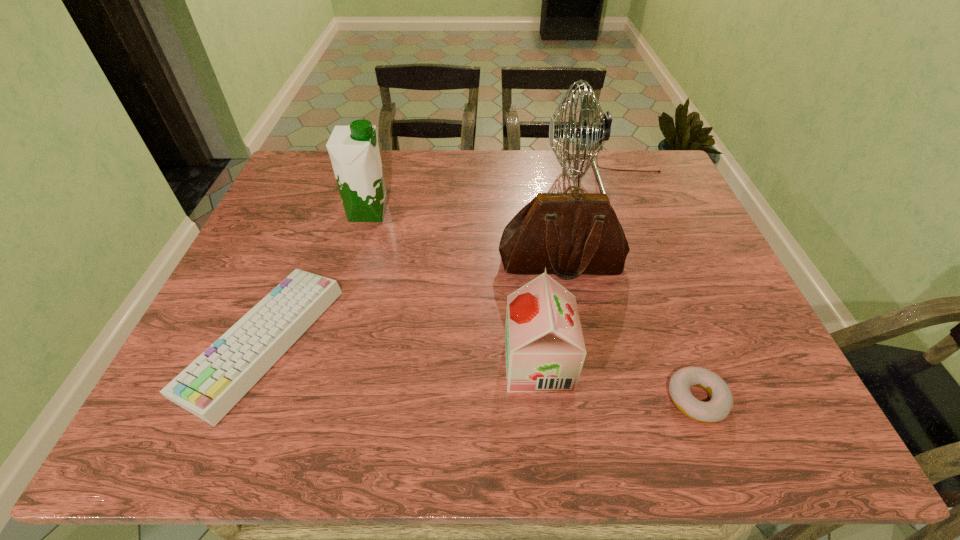
Locate an element on the screen. doughnut that is positioned at the near edge is located at coordinates [718, 408].

Find the location of a particular element. This screenshot has width=960, height=540. object that is at the left edge is located at coordinates (x=214, y=382).

Find the location of a particular element. Image resolution: width=960 pixels, height=540 pixels. fan located at the right edge is located at coordinates (600, 131).

Where is `doughnut positioned at the right edge`? The image size is (960, 540). doughnut positioned at the right edge is located at coordinates pyautogui.click(x=718, y=408).

In order to click on object situated at the near left corner in this screenshot , I will do `click(214, 382)`.

This screenshot has height=540, width=960. In order to click on object that is positioned at the far right corner in this screenshot , I will do `click(600, 131)`.

At what (x,y) coordinates should I click in order to perform the action: click on object situated at the near right corner. Please return your answer as a coordinate pair (x, y). The height and width of the screenshot is (540, 960). Looking at the image, I should click on (718, 408).

At what (x,y) coordinates should I click in order to perform the action: click on vacant space at the far edge of the desktop. Please return your answer as a coordinate pair (x, y). This screenshot has width=960, height=540. Looking at the image, I should click on (400, 154).

Where is `free space at the near edge of the desktop`? The width and height of the screenshot is (960, 540). free space at the near edge of the desktop is located at coordinates (x=363, y=403).

You are a GUI agent. You are given a task and a screenshot of the screen. Output one action in this format:
    pyautogui.click(x=<x>, y=<y>)
    Task: Click on the vacant region at the left edge
    This screenshot has width=960, height=540.
    Given the screenshot: What is the action you would take?
    pyautogui.click(x=255, y=294)